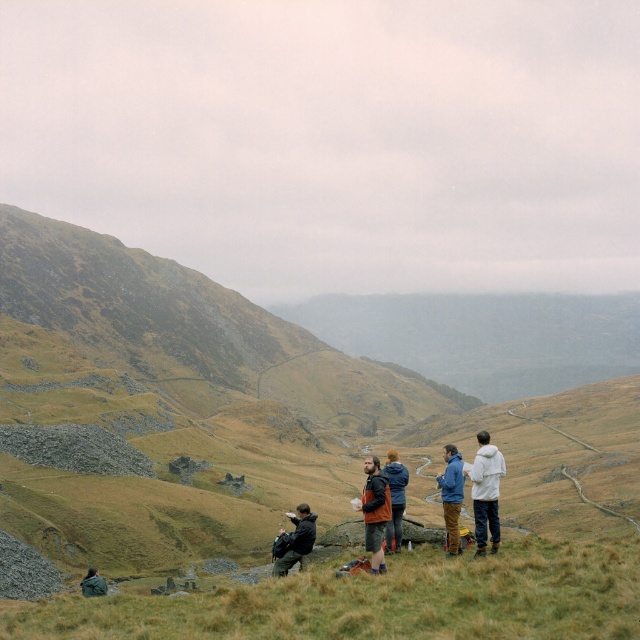
Which is behind, point (493, 499) or point (448, 509)?

The point (493, 499) is more distant.

Which of these two, white fleece jacket at right or blue jacket at center, stands taller?

blue jacket at center is taller.

Is point (486, 458) farther from viewer compared to point (451, 515)?

Yes, it is.

I want to click on white fleece jacket at right, so click(484, 492).

Is dark brown leather jacket at center taller than green fabric jacket at lower left?

In fact, dark brown leather jacket at center may be shorter than green fabric jacket at lower left.

Image resolution: width=640 pixels, height=640 pixels. What do you see at coordinates (374, 509) in the screenshot?
I see `dark brown leather jacket at center` at bounding box center [374, 509].

At what (x,y) coordinates should I click in order to perform the action: click on dark brown leather jacket at center. Please return your answer as a coordinate pair (x, y). This screenshot has width=640, height=640. Looking at the image, I should click on (374, 509).

What do you see at coordinates (296, 540) in the screenshot? The height and width of the screenshot is (640, 640). I see `dark gray jacket at center` at bounding box center [296, 540].

Is point (282, 572) more distant than point (388, 477)?

No, it is not.

What do you see at coordinates (296, 540) in the screenshot? This screenshot has height=640, width=640. I see `dark gray jacket at center` at bounding box center [296, 540].

Where is `dark gray jacket at center`? This screenshot has height=640, width=640. dark gray jacket at center is located at coordinates 296,540.